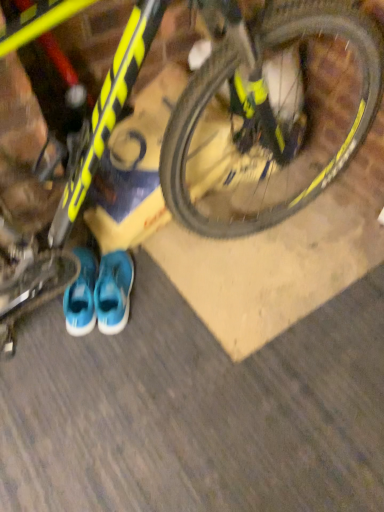
Question: Is blue fabric sneakers at lower center positioned with its back to yellow matte bicycle at upper center?

Choices:
 (A) no
 (B) yes

Answer: (A)

Question: Could you tell me if blue fabric sneakers at lower center is turned towards yellow matte bicycle at upper center?

Choices:
 (A) no
 (B) yes

Answer: (A)

Question: Considering the relative positions of blue fabric sneakers at lower center and yellow matte bicycle at upper center in the image provided, is blue fabric sneakers at lower center to the left of yellow matte bicycle at upper center from the viewer's perspective?

Choices:
 (A) yes
 (B) no

Answer: (A)

Question: Considering the relative positions of blue fabric sneakers at lower center and yellow matte bicycle at upper center in the image provided, is blue fabric sneakers at lower center to the right of yellow matte bicycle at upper center from the viewer's perspective?

Choices:
 (A) no
 (B) yes

Answer: (A)

Question: Does blue fabric sneakers at lower center contain yellow matte bicycle at upper center?

Choices:
 (A) yes
 (B) no

Answer: (B)

Question: Does blue fabric sneakers at lower center have a lesser width compared to yellow matte bicycle at upper center?

Choices:
 (A) yes
 (B) no

Answer: (A)

Question: Can you confirm if yellow matte bicycle at upper center is shorter than yellow matte bicycle at upper center?

Choices:
 (A) yes
 (B) no

Answer: (B)

Question: From the image's perspective, does yellow matte bicycle at upper center appear lower than yellow matte bicycle at upper center?

Choices:
 (A) no
 (B) yes

Answer: (A)

Question: Can you confirm if yellow matte bicycle at upper center is smaller than yellow matte bicycle at upper center?

Choices:
 (A) no
 (B) yes

Answer: (A)

Question: From a real-world perspective, is yellow matte bicycle at upper center located beneath yellow matte bicycle at upper center?

Choices:
 (A) no
 (B) yes

Answer: (A)

Question: Is yellow matte bicycle at upper center behind yellow matte bicycle at upper center?

Choices:
 (A) yes
 (B) no

Answer: (B)

Question: Does yellow matte bicycle at upper center appear on the right side of yellow matte bicycle at upper center?

Choices:
 (A) yes
 (B) no

Answer: (B)

Question: Is blue fabric running shoe at lower center bigger than blue fabric sneakers at lower center?

Choices:
 (A) no
 (B) yes

Answer: (B)